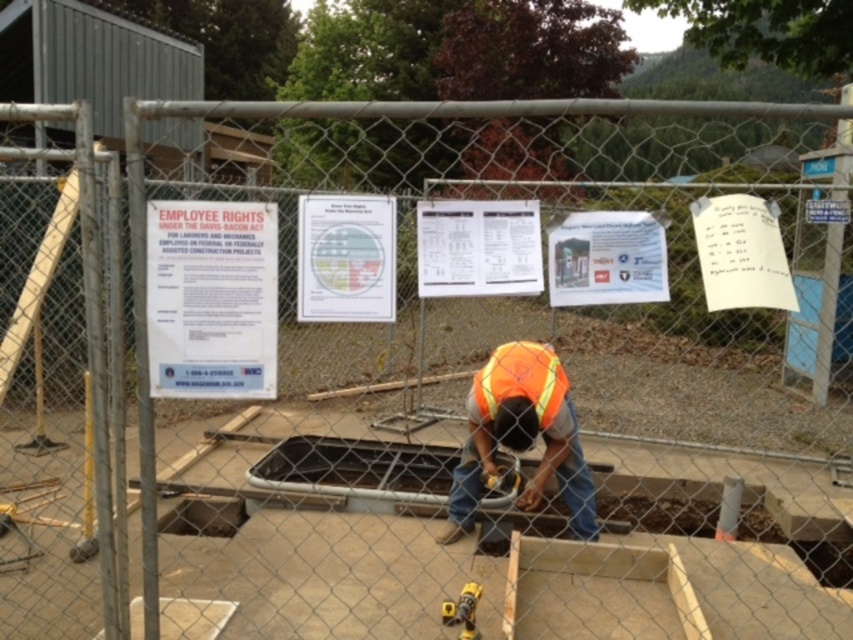
Does concrete at center have a larger size compared to yellow rubber drill at center?

Yes.

Between concrete at center and yellow rubber drill at center, which one appears on the right side from the viewer's perspective?

concrete at center is more to the right.

Does point (843, 556) come behind point (457, 620)?

That is True.

The width and height of the screenshot is (853, 640). Identify the location of concrete at center. (827, 561).

Does orange reflective safety vest at center have a greater width compared to yellow rubber drill at center?

Correct, the width of orange reflective safety vest at center exceeds that of yellow rubber drill at center.

Identify the location of orange reflective safety vest at center. This screenshot has width=853, height=640. point(521,380).

Who is more forward, (171, 292) or (476, 433)?

Point (171, 292) is in front.

Is point (236, 266) less distant than point (479, 458)?

Yes.

Where is `white paper sign at upper left`? This screenshot has height=640, width=853. white paper sign at upper left is located at coordinates (212, 298).